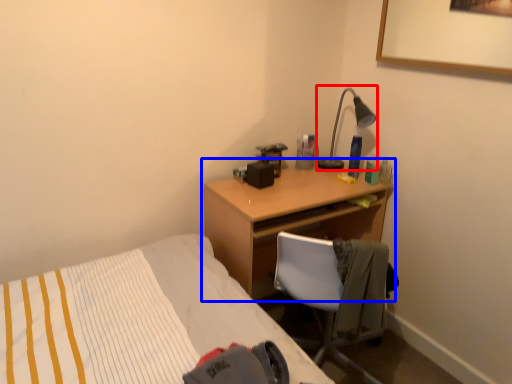
Question: Which of the following is the closest to the observer, lamp (highlighted by a red box) or desk (highlighted by a blue box)?

Choices:
 (A) lamp
 (B) desk

Answer: (B)